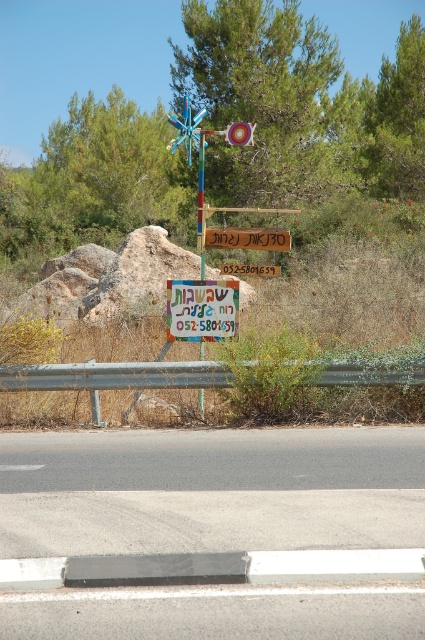
Question: Can you confirm if matte plastic sign at center is smaller than brown wooden sign at center?

Choices:
 (A) no
 (B) yes

Answer: (A)

Question: In this image, where is matte plastic sign at center located relative to metallic pole at center?

Choices:
 (A) right
 (B) left

Answer: (A)

Question: Which point appears closest to the camera in this image?

Choices:
 (A) click(98, 276)
 (B) click(396, 458)

Answer: (B)

Question: Which point is closer to the camera?

Choices:
 (A) brown wooden sign at center
 (B) metallic pole at center
 (C) matte plastic sign at center

Answer: (B)

Question: Is rough textured rock at center positioned behind matte plastic sign at center?

Choices:
 (A) yes
 (B) no

Answer: (B)

Question: Considering the real-world distances, which object is closest to the wooden sign at center?

Choices:
 (A) brown wooden sign at center
 (B) gray asphalt road at center
 (C) matte plastic sign at center

Answer: (C)